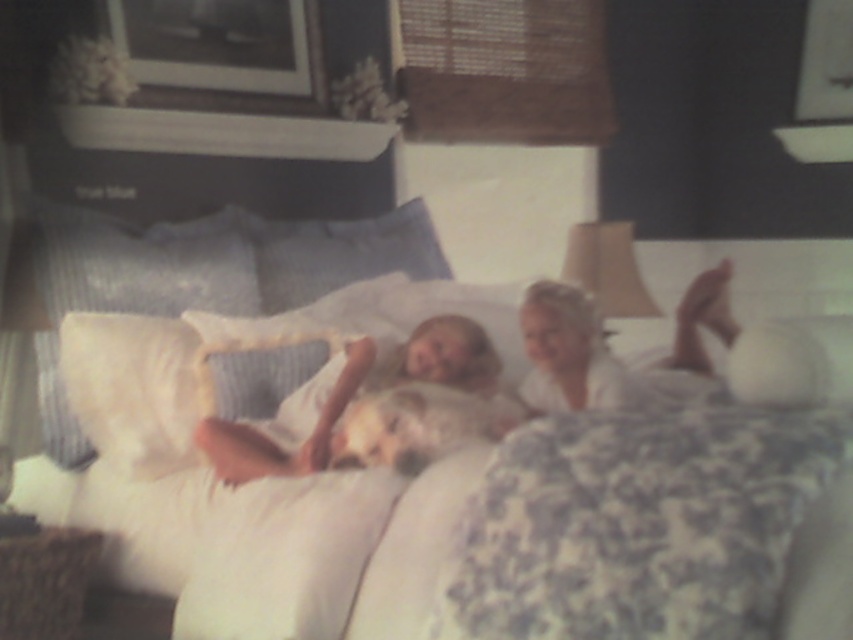
Question: Is white soft fabric at center below white textured pillow at left?

Choices:
 (A) yes
 (B) no

Answer: (A)

Question: Among these points, which one is farthest from the camera?

Choices:
 (A) (711, 321)
 (B) (314, 387)
 (C) (108, 275)

Answer: (A)

Question: Does white textured pillow at left have a larger size compared to white cotton shirt at upper center?

Choices:
 (A) yes
 (B) no

Answer: (A)

Question: Estimate the real-world distances between objects in this image. Which object is closer to the white soft fabric at center?

Choices:
 (A) white textured pillow at left
 (B) white cotton shirt at upper center
 (C) white soft bed at center

Answer: (C)

Question: Estimate the real-world distances between objects in this image. Which object is closer to the white soft bed at center?

Choices:
 (A) white cotton shirt at upper center
 (B) white soft fabric at center
 (C) white textured pillow at left

Answer: (B)

Question: From the image, what is the correct spatial relationship of white soft bed at center in relation to white textured pillow at left?

Choices:
 (A) right
 (B) left

Answer: (A)